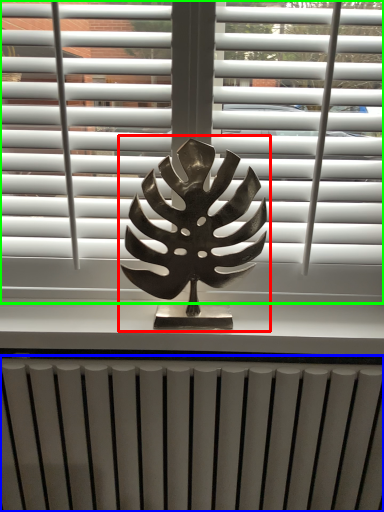
Question: Which is nearer to the bronze statue (highlighted by a red box)? radiator (highlighted by a blue box) or window blind (highlighted by a green box).

Choices:
 (A) radiator
 (B) window blind

Answer: (B)